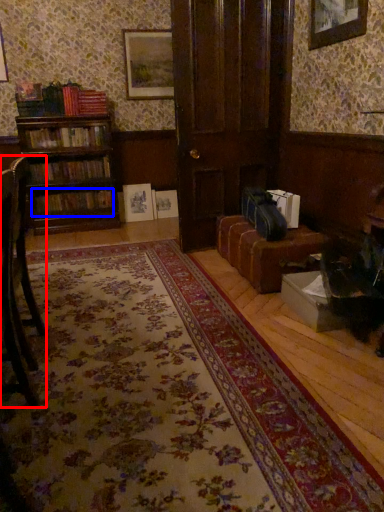
Question: Among these objects, which one is farthest to the camera, chair (highlighted by a red box) or book (highlighted by a blue box)?

Choices:
 (A) chair
 (B) book

Answer: (B)